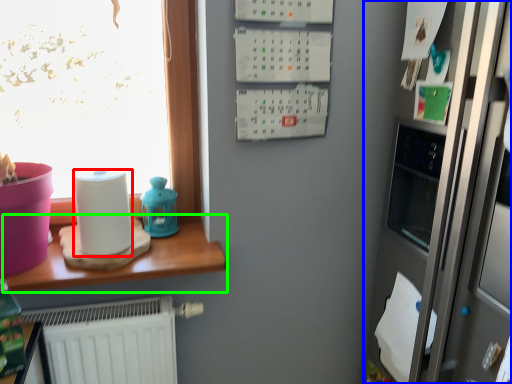
Question: Which object is the farthest from paper towel (highlighted by a red box)? Choose among these: fridge (highlighted by a blue box) or table (highlighted by a green box).

Choices:
 (A) fridge
 (B) table

Answer: (A)